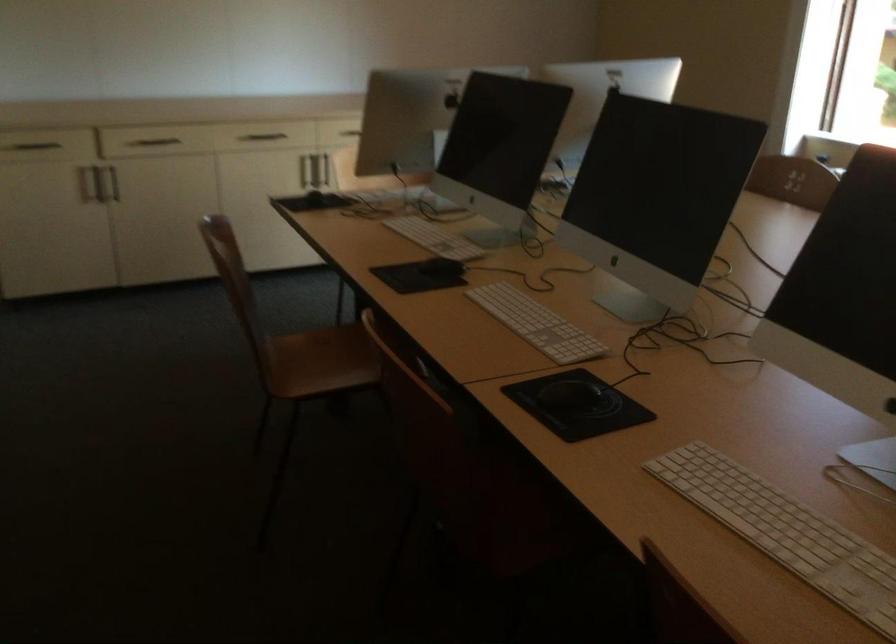
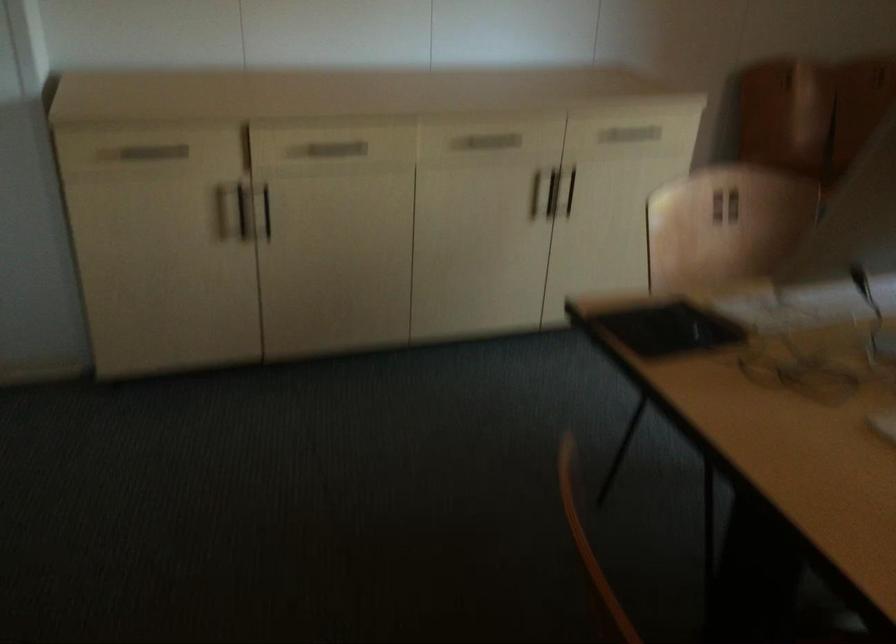
Locate, in the second image, the point that corresponds to pixel 309 169 in the first image.

(552, 192)